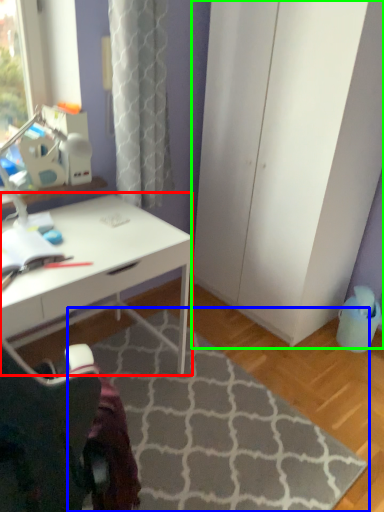
Question: Which is nearer to the desk (highlighted by a red box)? doormat (highlighted by a blue box) or screen door (highlighted by a green box).

Choices:
 (A) doormat
 (B) screen door

Answer: (A)